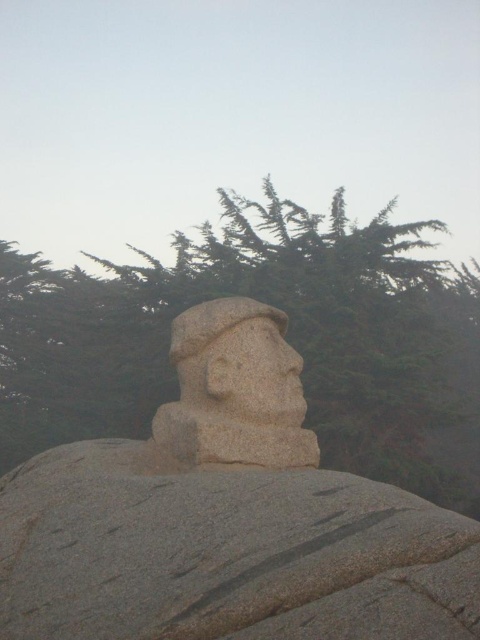
You are an art conservator assessing the granite statue at center and the granite statue head at center. Which part of the statue do you think is bigger in size?

The granite statue at center has a larger size compared to the granite statue head at center, so the entire statue is bigger than its head.

You are an art student standing in front of the granite statue at center. You want to sketch the granite statue head at center first. Which part should you focus on first if you want to start with the closest part?

The granite statue at center is closer to the viewer than the granite statue head at center, so you should focus on the granite statue at center first before moving to the head.

You are standing in front of the stone sculpture and notice a point marked at coordinates (288, 340). What object does this point indicate?

The point at coordinates (288, 340) marks the green textured tree at upper center.